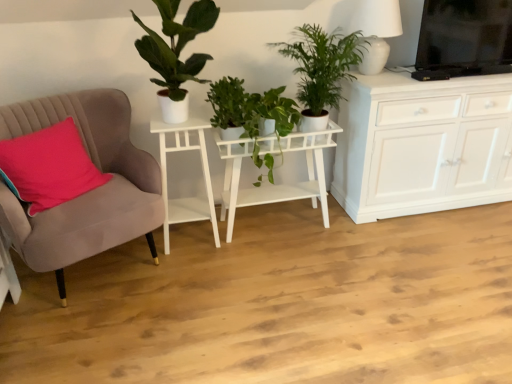
Question: From a real-world perspective, is pink fabric pillow at left positioned above or below white matte plant stand at center, the 2th table from the left?

Choices:
 (A) below
 (B) above

Answer: (B)

Question: Is pink fabric pillow at left situated inside white matte plant stand at center, the 2th table from the left, or outside?

Choices:
 (A) inside
 (B) outside

Answer: (B)

Question: Estimate the real-world distances between objects in this image. Which object is farther from the green leafy plant at upper center, marked as the first houseplant in a right-to-left arrangement?

Choices:
 (A) pink fabric pillow at left
 (B) white matte side table at left, placed as the second table when sorted from right to left
 (C) white ceramic lamp at upper right
 (D) green matte plant at upper left, which is the first houseplant in left-to-right order
 (E) white matte plant stand at center, the first table positioned from the right

Answer: (A)

Question: Estimate the real-world distances between objects in this image. Which object is closer to the white matte plant stand at center, the 2th table from the left?

Choices:
 (A) pink fabric pillow at left
 (B) green matte plant at upper left, which is counted as the third houseplant, starting from the right
 (C) suede armchair at left
 (D) green glossy plant at center, which appears as the second houseplant when viewed from the right
 (E) white matte side table at left, which is counted as the 1th table, starting from the left

Answer: (D)